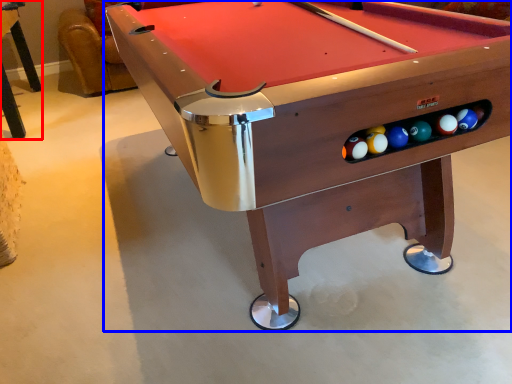
Question: Which point is further to the camera, table (highlighted by a red box) or billiard table (highlighted by a blue box)?

Choices:
 (A) table
 (B) billiard table

Answer: (A)